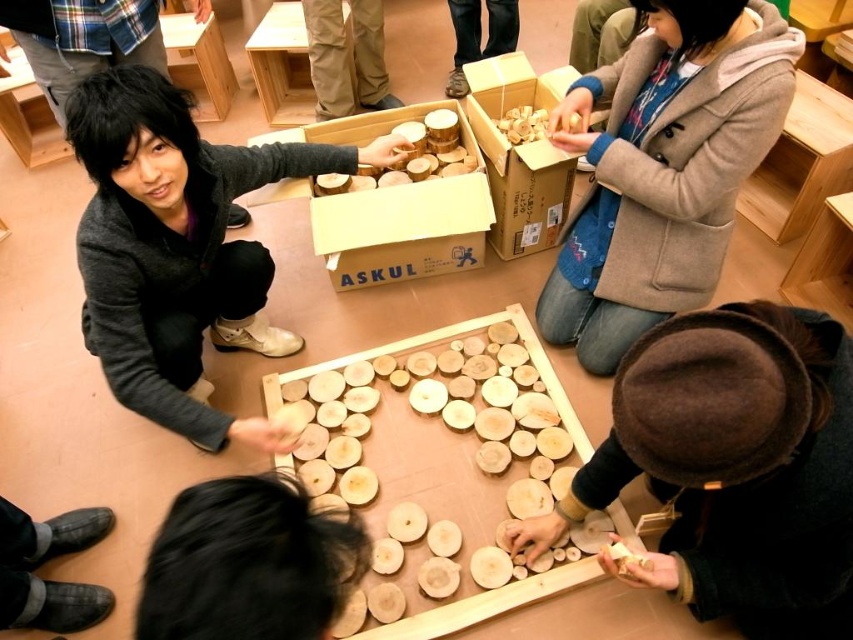
Question: Does matte gray jacket at lower left have a larger size compared to black leather shoes at lower left?

Choices:
 (A) yes
 (B) no

Answer: (A)

Question: Is matte gray jacket at lower left closer to camera compared to natural wood box at center?

Choices:
 (A) no
 (B) yes

Answer: (B)

Question: In this image, where is light brown woolen coat at upper right located relative to matte gray jacket at lower left?

Choices:
 (A) right
 (B) left

Answer: (A)

Question: Estimate the real-world distances between objects in this image. Which object is closer to the black leather shoes at lower left?

Choices:
 (A) matte gray jacket at lower left
 (B) dark brown hair at lower center

Answer: (A)

Question: Which of these objects is positioned farthest from the matte gray jacket at lower left?

Choices:
 (A) black leather shoes at lower left
 (B) light brown woolen coat at upper right
 (C) brown cardboard box at center
 (D) natural wood box at center

Answer: (B)

Question: Which object is the farthest from the dark brown hair at lower center?

Choices:
 (A) brown cardboard box at center
 (B) brown felt hat at lower right
 (C) black leather shoes at lower left

Answer: (A)